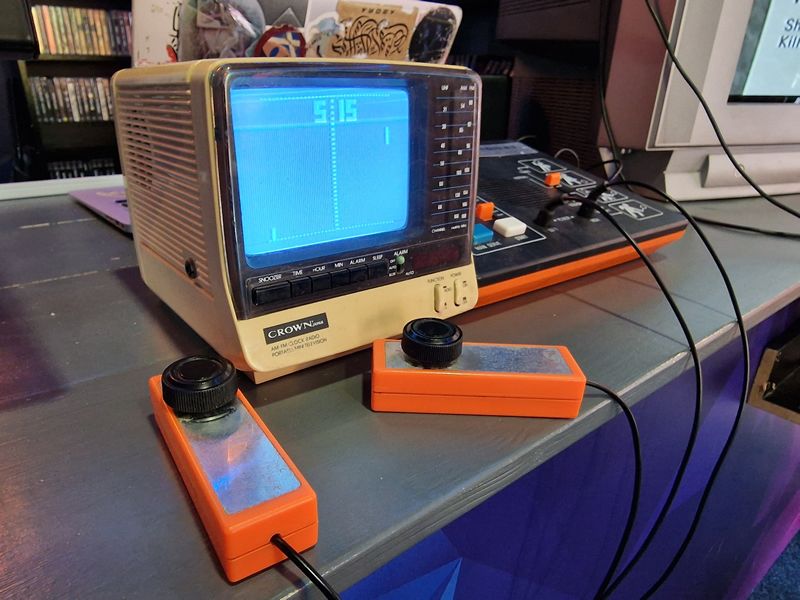
You are a GUI agent. You are given a task and a screenshot of the screen. Output one action in this format:
    pyautogui.click(x=<x>, y=<y>)
    Task: Click on the desk
    Image resolution: width=800 pixels, height=600 pixels.
    Given the screenshot: What is the action you would take?
    pyautogui.click(x=552, y=496)